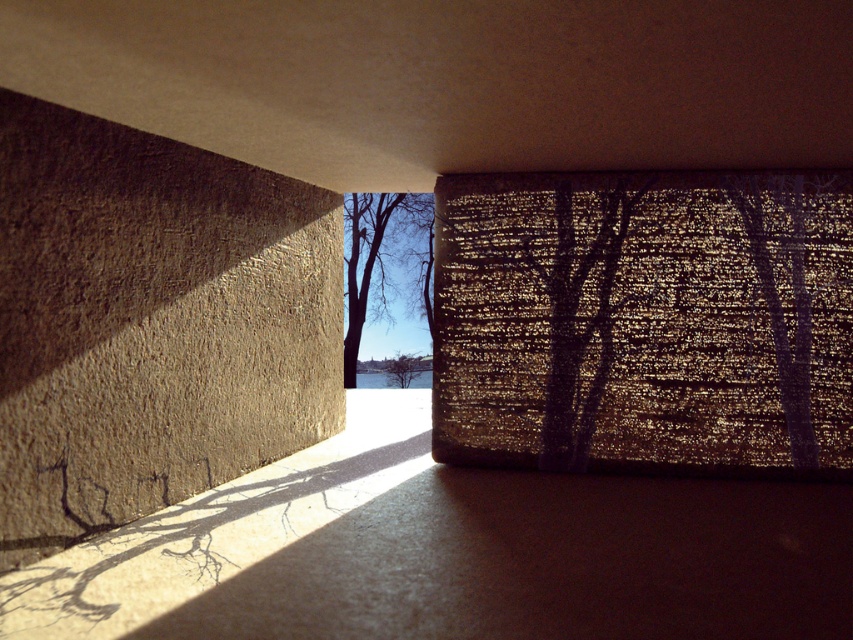
Based on the photo, you are an architect analyzing the building structure. You notice the smooth concrete wall at center and the bare branches at center in the image. Which object is closer to the ground?

The smooth concrete wall at center is positioned under the bare branches at center, so it is closer to the ground than the branches.

You are an architect analyzing the building structure. You observe the smooth concrete wall at center and the bare branches at center in the image. Which of these two elements is shorter in height?

The smooth concrete wall at center is not as tall as the bare branches at center, so the smooth concrete wall at center is shorter in height.

You are an architect analyzing the light patterns in the image. You observe the bare branches at center and the green leafy tree at center. Which of these two objects casts a larger shadow on the wall?

The bare branches at center casts a larger shadow on the wall because it has a larger size compared to the green leafy tree at center.